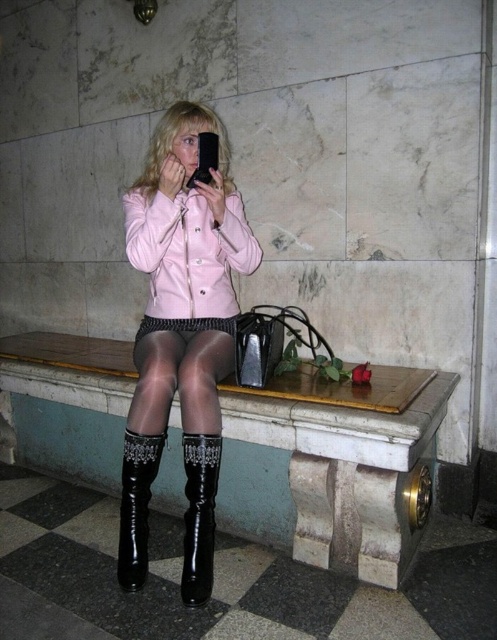
Question: Can you confirm if wooden bench at center is positioned below glossy patent leather boots at lower center?

Choices:
 (A) yes
 (B) no

Answer: (A)

Question: Among these points, which one is nearest to the camera?

Choices:
 (A) (42, 372)
 (B) (119, 556)

Answer: (B)

Question: Which object is positioned closest to the black leather boot at lower center?

Choices:
 (A) black leather boot at lower left
 (B) glossy patent leather boots at lower center
 (C) sheer black tights at center

Answer: (A)

Question: Among these objects, which one is nearest to the camera?

Choices:
 (A) wooden bench at center
 (B) black leather boot at lower center
 (C) black leather boot at lower left
 (D) sheer black tights at center

Answer: (A)

Question: Does sheer black tights at center appear on the right side of black leather boot at lower left?

Choices:
 (A) no
 (B) yes

Answer: (B)

Question: Where is wooden bench at center located in relation to sheer black tights at center in the image?

Choices:
 (A) left
 (B) right

Answer: (A)